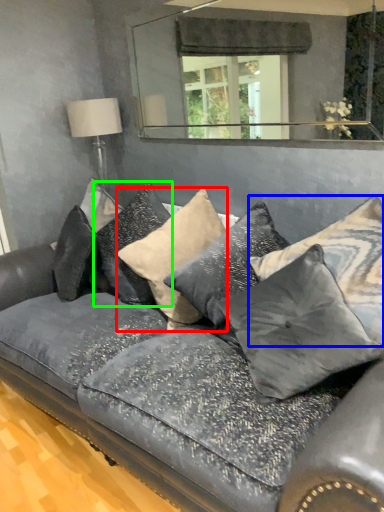
Question: Based on their relative distances, which object is farther from pillow (highlighted by a red box)? Choose from pillow (highlighted by a blue box) and pillow (highlighted by a green box).

Choices:
 (A) pillow
 (B) pillow

Answer: (A)